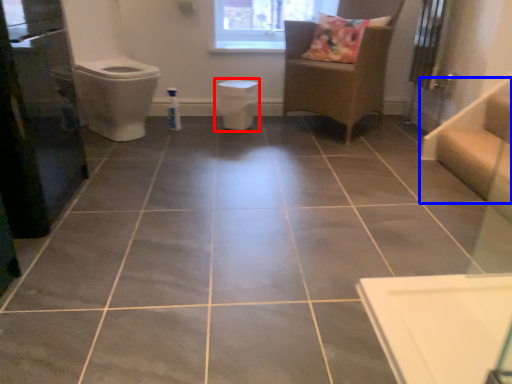
Question: Which object is further to the camera taking this photo, toilet bowl (highlighted by a red box) or stairwell (highlighted by a blue box)?

Choices:
 (A) toilet bowl
 (B) stairwell

Answer: (A)